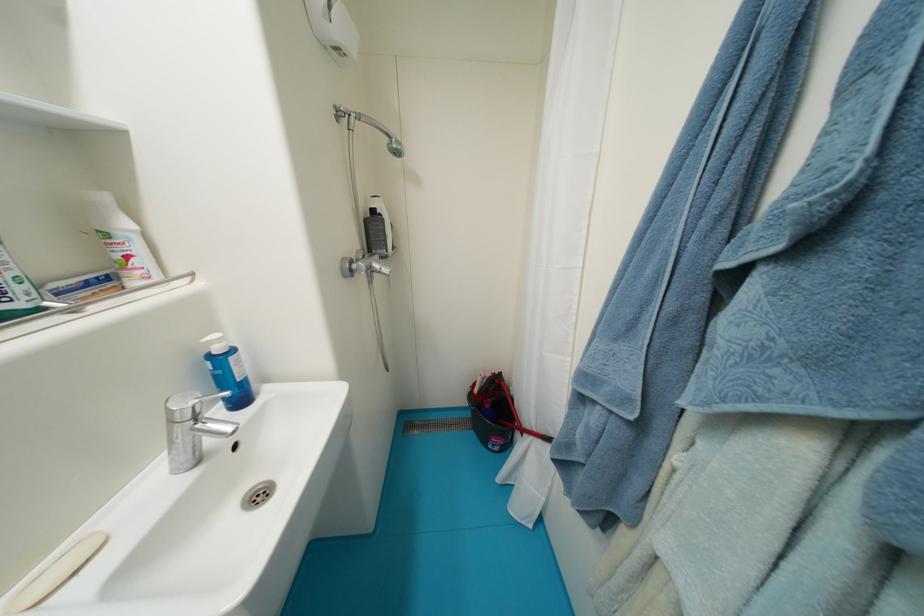
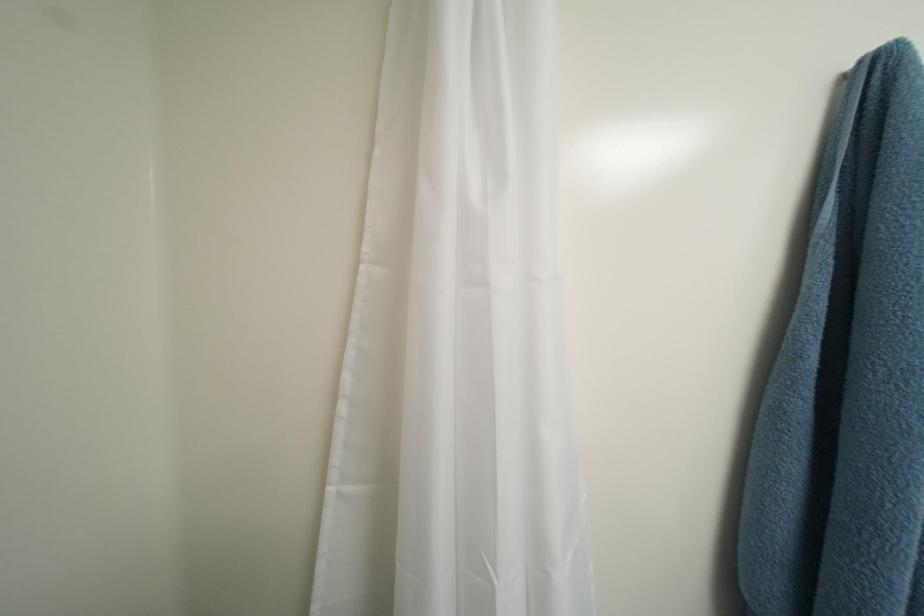
Question: The camera is either moving clockwise (left) or counter-clockwise (right) around the object. The first image is from the beginning of the video and the second image is from the end. Is the camera moving left or right when shooting the video?

Choices:
 (A) Left
 (B) Right

Answer: (A)